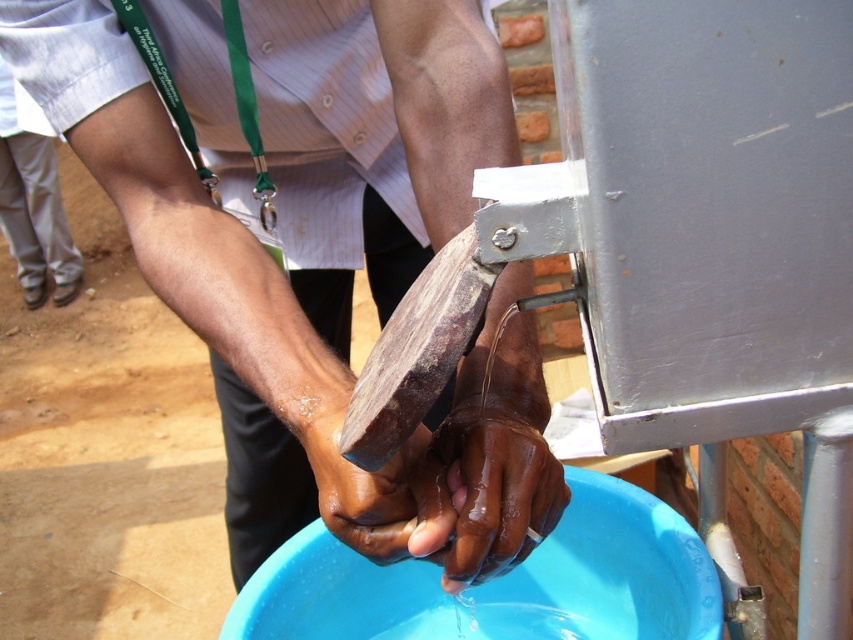
Looking at this image, you are designing a new hand sanitizer dispenser. The dispenser needs to be placed on the brown wooden block at center so that the brown matte hand at lower center can easily reach it. Based on the current dimensions, will the dispenser fit on the block?

The brown wooden block at center might be wider than brown matte hand at lower center, so the dispenser could potentially fit if its width is within the block dimensions. However, the exact fit depends on the dispenser size compared to the block width.

You are standing at the handwashing station and want to reach a soap dispenser located at point (399, 276). If your arm can extend 3 feet, can you reach it?

The distance of point (399, 276) from camera is 3.62 feet, so no, your arm cannot reach the soap dispenser since it is farther than 3 feet.